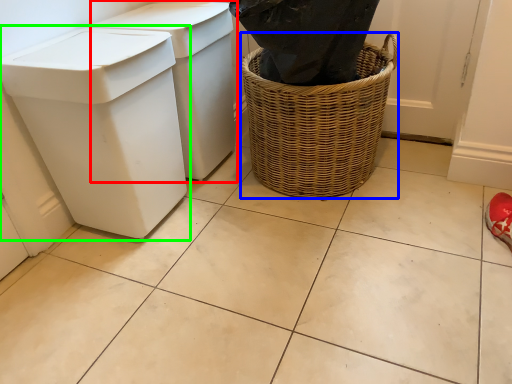
Question: Which object is positioned farthest from waste container (highlighted by a red box)? Select from basket container (highlighted by a blue box) and waste container (highlighted by a green box).

Choices:
 (A) basket container
 (B) waste container

Answer: (A)